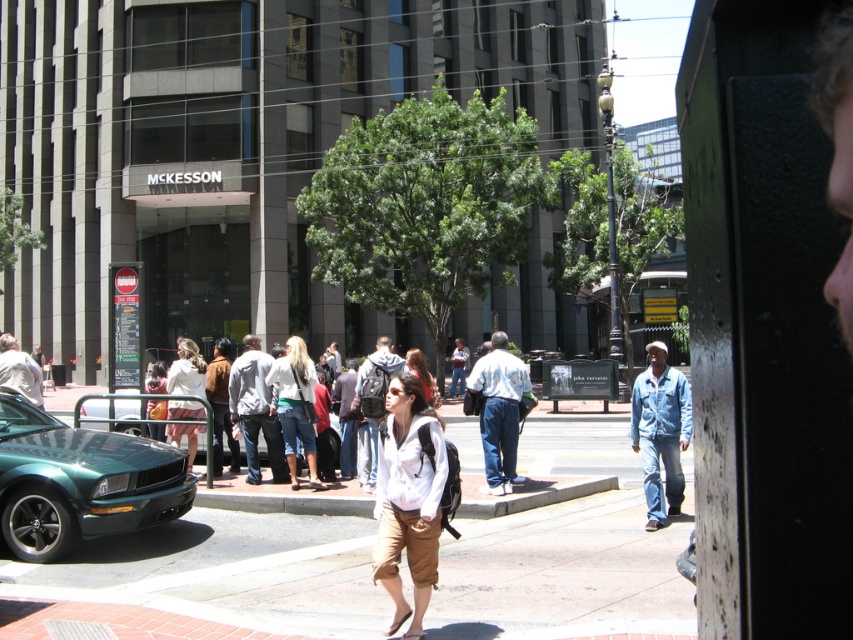
You are a photographer standing on the sidewalk. You see a woman wearing a white cotton dress at center and a man wearing a brown leather jacket at center. Which clothing item appears narrower when viewed from your position?

The white cotton dress at center appears narrower than the brown leather jacket at center.

You are standing on the sidewalk and want to walk towards the MCKESSON building. There are two points marked on the ground ahead of you. Which point, point (x=184, y=381) or point (x=219, y=396), is closer to you?

Point (x=184, y=381) is closer to you than point (x=219, y=396).

You are a photographer standing on the sidewalk. You want to take a photo of the MCKESSON building while ensuring that both the denim shorts at center and the matte orange backpack at center are visible in the frame. Which object should you focus on to make sure both are in focus?

The denim shorts at center is thinner than the matte orange backpack at center, so you should focus on the matte orange backpack at center because it is larger and will be easier to keep in focus while ensuring the thinner denim shorts at center also stays within the depth of field.